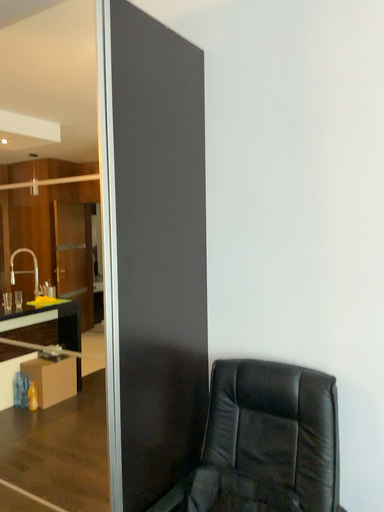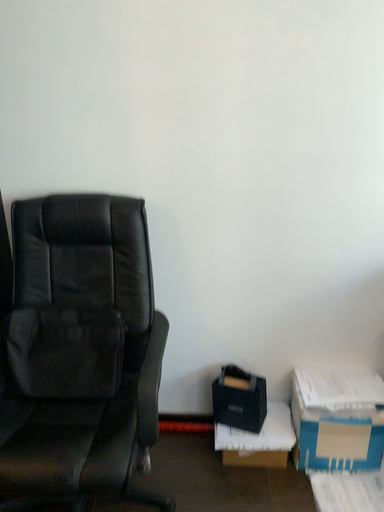
Question: How did the camera likely rotate when shooting the video?

Choices:
 (A) rotated left
 (B) rotated right

Answer: (B)